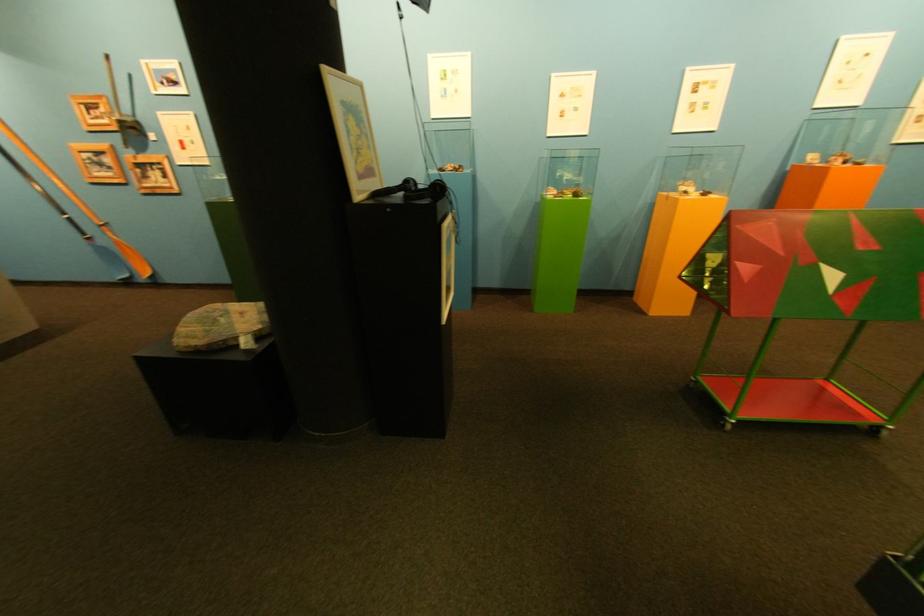
Where is `wooden oar`? This screenshot has height=616, width=924. wooden oar is located at coordinates (78, 213).